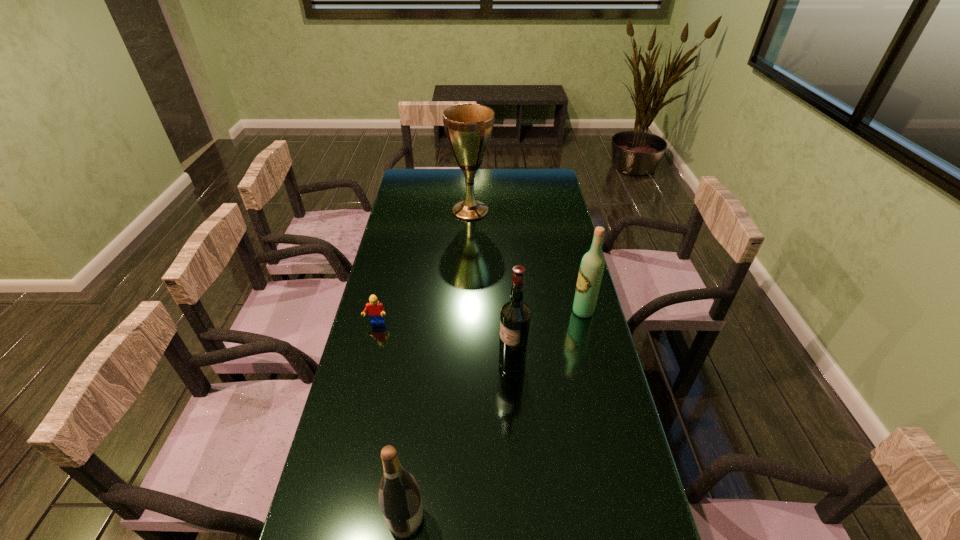
In order to click on vacant space located on the front and back of the fourth farthest object in this screenshot , I will do (442, 366).

Where is `free spot located 0.300m on the front and back of the fourth farthest object`? This screenshot has height=540, width=960. free spot located 0.300m on the front and back of the fourth farthest object is located at coordinates (397, 366).

Where is `free space located 0.290m on the front and back of the fourth farthest object`? This screenshot has height=540, width=960. free space located 0.290m on the front and back of the fourth farthest object is located at coordinates (401, 366).

The width and height of the screenshot is (960, 540). In order to click on vacant space located on the front-facing side of the farthest wine bottle in this screenshot , I will do `click(492, 311)`.

Identify the location of free region located 0.080m on the front-facing side of the farthest wine bottle. (548, 311).

Where is `vacant region located 0.050m on the front-facing side of the farthest wine bottle`? The height and width of the screenshot is (540, 960). vacant region located 0.050m on the front-facing side of the farthest wine bottle is located at coordinates (557, 311).

Where is `free location located 0.340m on the label of the nearest object`? The image size is (960, 540). free location located 0.340m on the label of the nearest object is located at coordinates (575, 519).

Where is `vacant region located 0.320m on the front-facing side of the leftmost object`? This screenshot has height=540, width=960. vacant region located 0.320m on the front-facing side of the leftmost object is located at coordinates (354, 415).

At what (x,y) coordinates should I click in order to perform the action: click on object present at the left edge. Please return your answer as a coordinate pair (x, y). The image size is (960, 540). Looking at the image, I should click on (375, 309).

Find the location of a particular element. The width and height of the screenshot is (960, 540). object that is at the right edge is located at coordinates (591, 269).